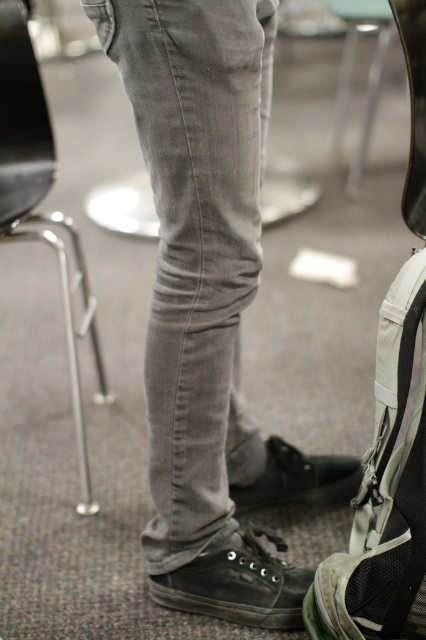
Which is more to the left, denim pants at center or black suede shoe at lower center?

Positioned to the left is denim pants at center.

Looking at this image, which of these two, denim pants at center or black suede shoe at lower center, stands taller?

Standing taller between the two is denim pants at center.

Identify the location of denim pants at center. (207, 305).

Measure the distance between metallic silver chair at left and black suede shoe at lower center.

metallic silver chair at left and black suede shoe at lower center are 22.37 inches apart from each other.

Which is above, metallic silver chair at left or black suede shoe at lower center?

metallic silver chair at left is above.

The height and width of the screenshot is (640, 426). I want to click on metallic silver chair at left, so click(40, 198).

Between denim pants at center and dark brown canvas shoe at lower center, which one is positioned lower?

dark brown canvas shoe at lower center is below.

Is point (166, 241) behind point (218, 616)?

No, it is not.

Locate an element on the screen. denim pants at center is located at coordinates (207, 305).